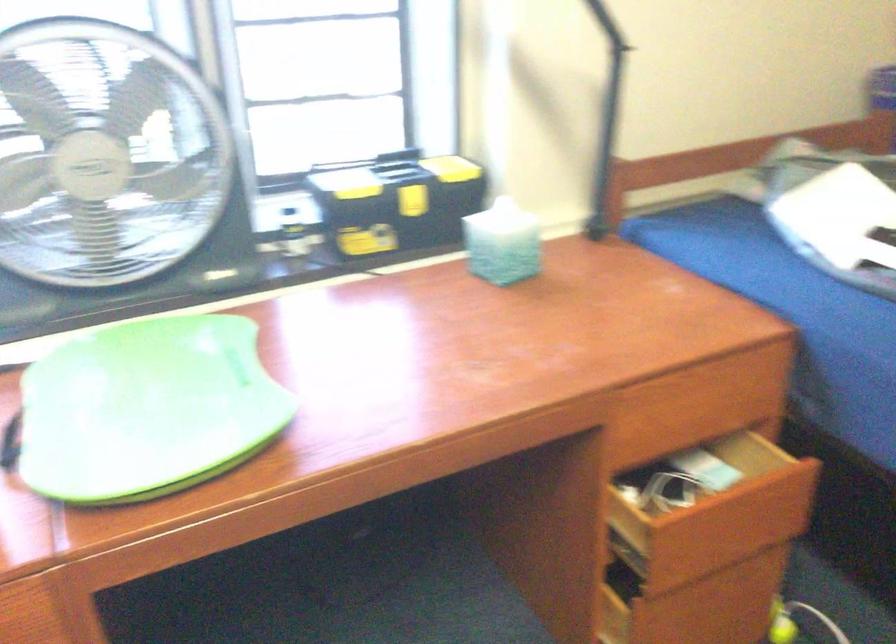
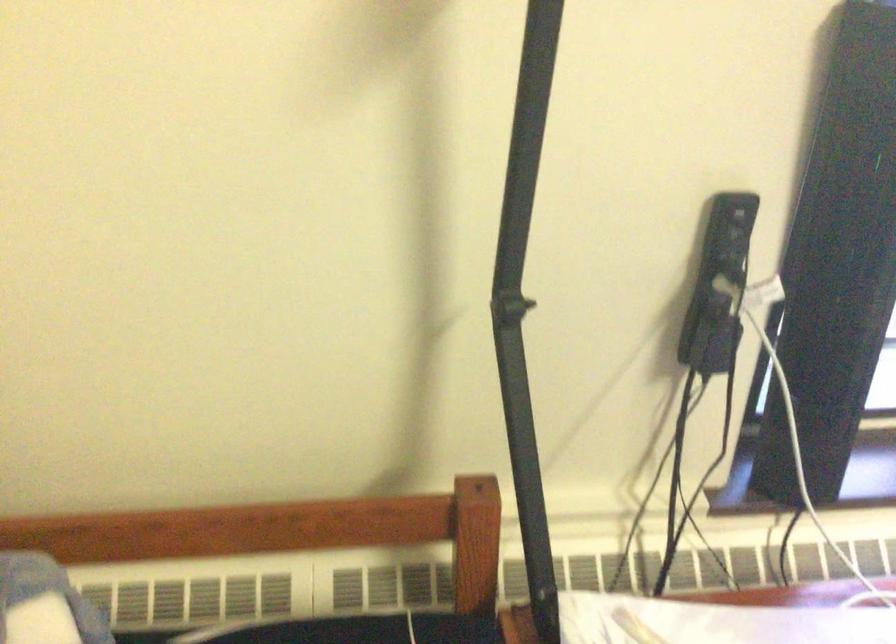
Question: Which direction would the cameraman need to move to produce the second image? Reply with the corresponding letter.

Choices:
 (A) Left
 (B) Right
 (C) Forward
 (D) Backward

Answer: (A)